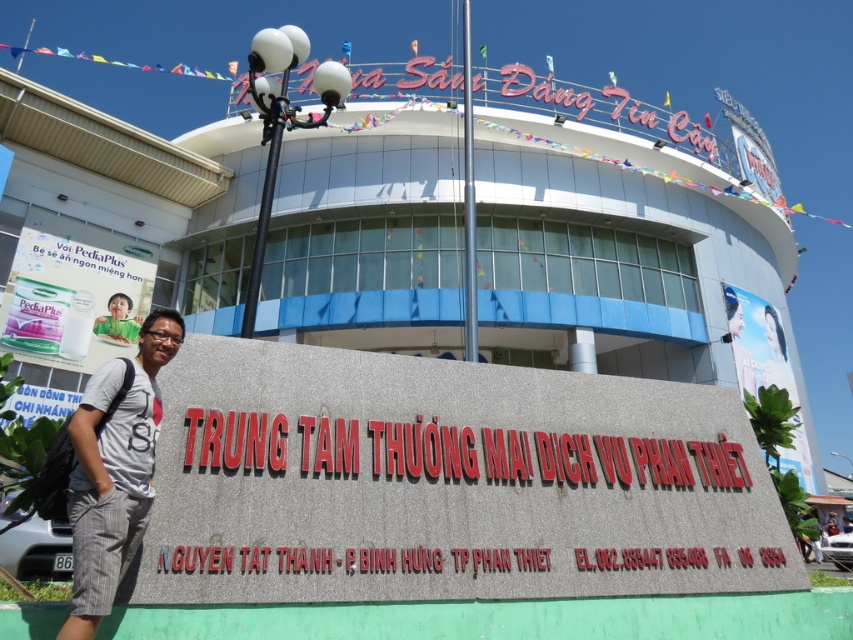
Question: Can you confirm if gray cotton t-shirt at left is wider than white plastic sign at upper left?

Choices:
 (A) yes
 (B) no

Answer: (B)

Question: Which object appears closest to the camera in this image?

Choices:
 (A) white plastic sign at upper left
 (B) gray cotton t-shirt at left

Answer: (B)

Question: Is gray cotton t-shirt at left positioned in front of white plastic sign at upper left?

Choices:
 (A) no
 (B) yes

Answer: (B)

Question: Which object is closer to the camera taking this photo?

Choices:
 (A) gray cotton t-shirt at left
 (B) white plastic sign at upper left

Answer: (A)

Question: Where is gray cotton t-shirt at left located in relation to white plastic sign at upper left in the image?

Choices:
 (A) above
 (B) below

Answer: (B)